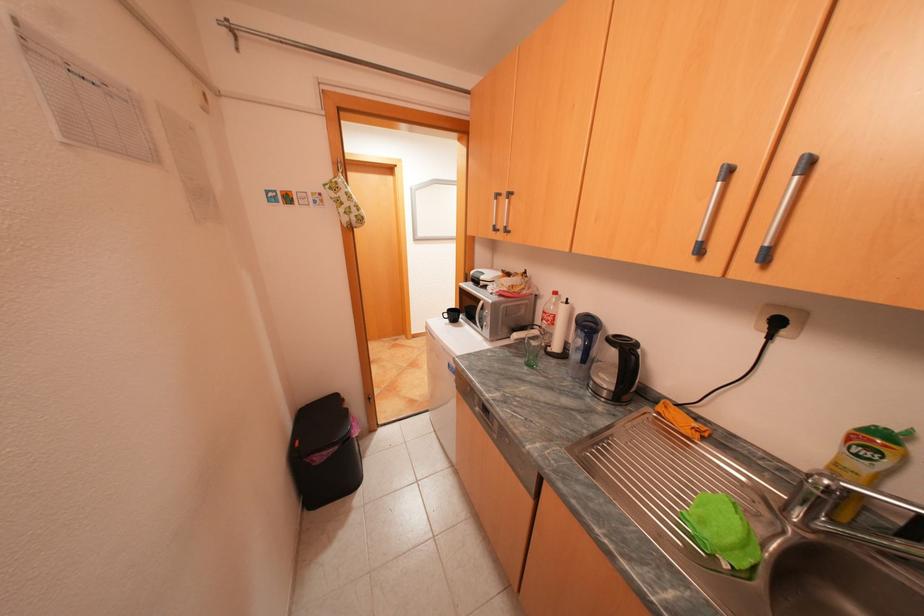
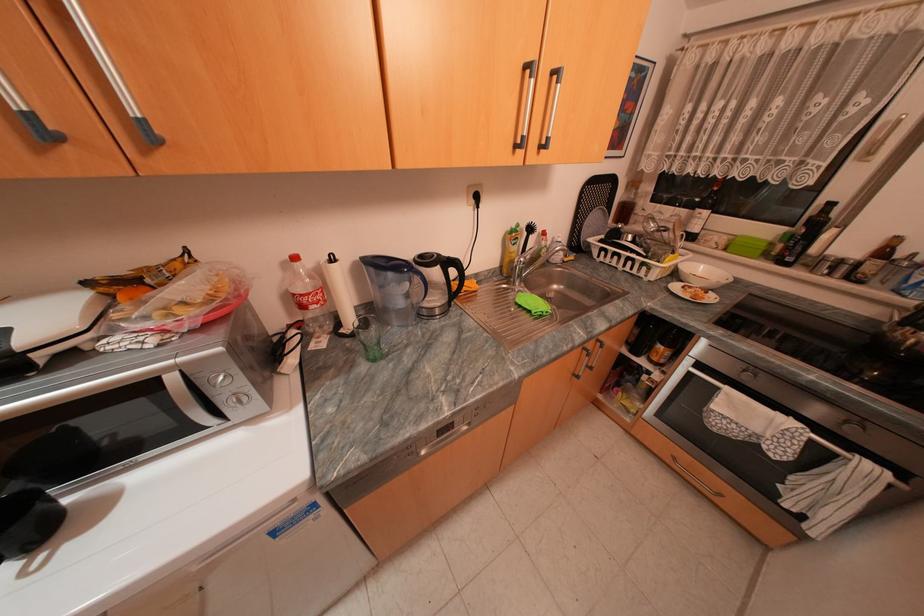
Locate, in the second image, the point that corresponds to [492,302] in the first image.

(181, 378)